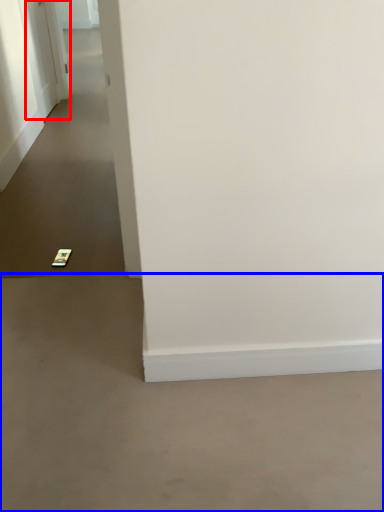
Question: Among these objects, which one is farthest to the camera, door (highlighted by a red box) or concrete (highlighted by a blue box)?

Choices:
 (A) door
 (B) concrete

Answer: (A)